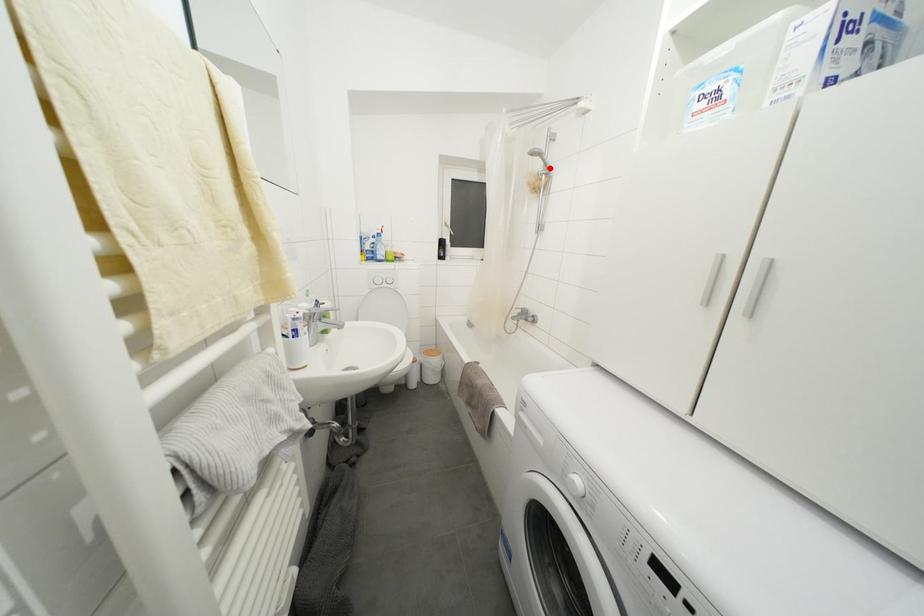
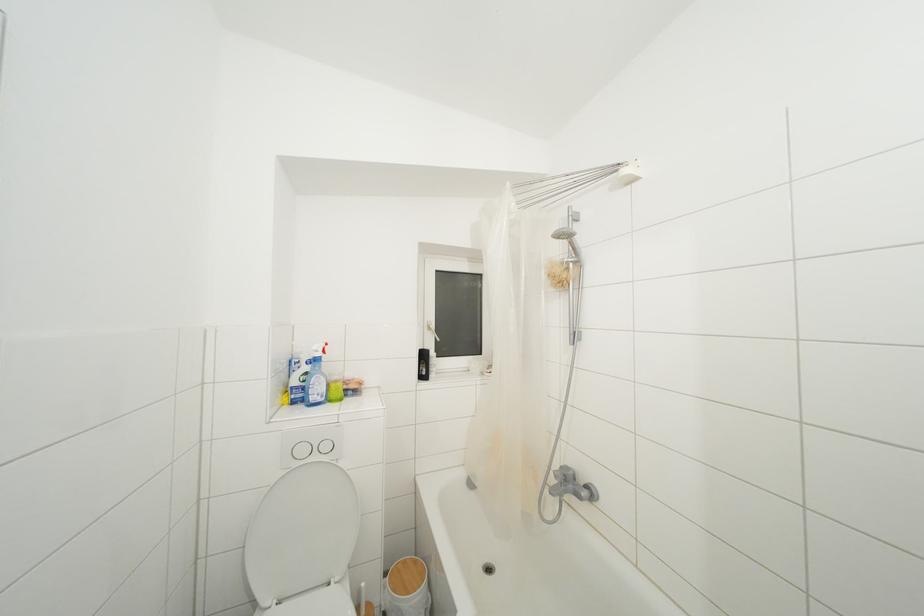
Locate, in the second image, the point that corresponds to the highlighted location in the first image.

(578, 254)